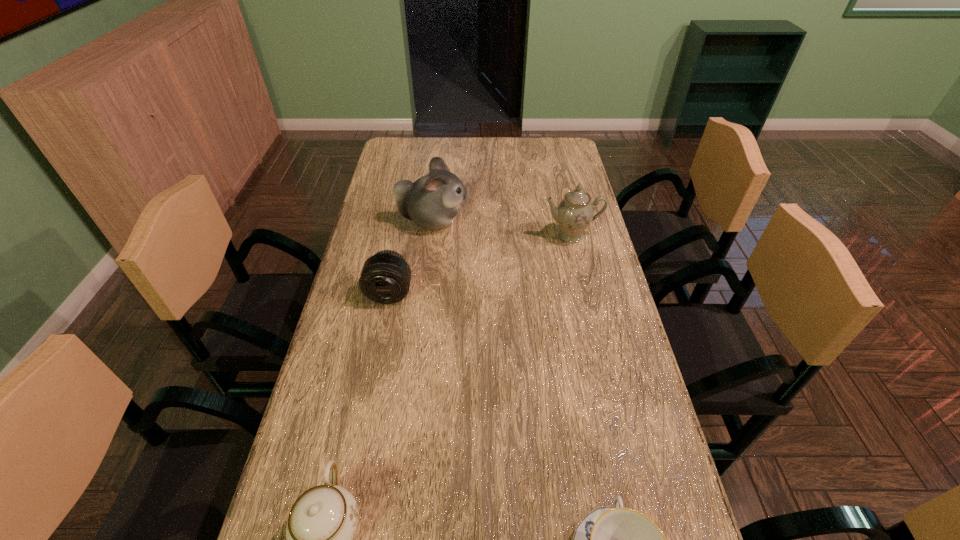
Image resolution: width=960 pixels, height=540 pixels. I want to click on free space at the left edge of the desktop, so click(365, 309).

In the image, there is a desktop. Identify the location of vacant space at the right edge. The height and width of the screenshot is (540, 960). (571, 173).

The height and width of the screenshot is (540, 960). In the image, there is a desktop. Identify the location of free space at the far left corner. (396, 166).

Identify the location of free space between the telephoto lens and the farthest chinaware. (480, 265).

Locate an element on the screen. Image resolution: width=960 pixels, height=540 pixels. unoccupied area between the farthest chinaware and the hamster is located at coordinates (501, 228).

Image resolution: width=960 pixels, height=540 pixels. Identify the location of blank region between the third nearest object and the farthest chinaware. (480, 265).

Where is `the closest object to the telephoto lens`? The image size is (960, 540). the closest object to the telephoto lens is located at coordinates (432, 201).

Locate which object ranks second in proximity to the leftmost chinaware. Please provide its 2D coordinates. Your answer should be formatted as a tuple, i.e. [(x, y)], where the tuple contains the x and y coordinates of a point satisfying the conditions above.

[(385, 278)]

Select which chinaware is the second closest to the third nearest object. Please provide its 2D coordinates. Your answer should be formatted as a tuple, i.e. [(x, y)], where the tuple contains the x and y coordinates of a point satisfying the conditions above.

[(322, 523)]

The width and height of the screenshot is (960, 540). In order to click on chinaware that stands as the closest to the third nearest object in this screenshot , I will do `click(574, 213)`.